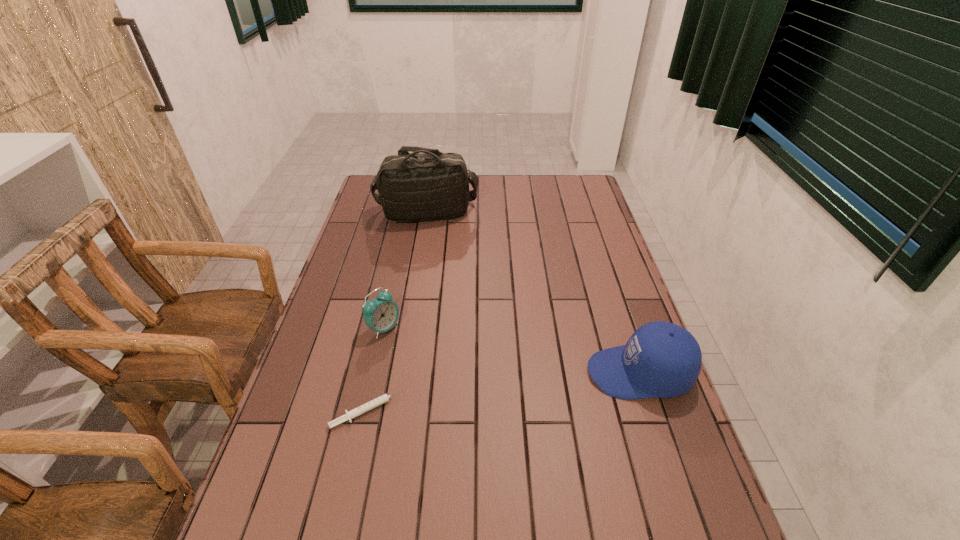
You are a GUI agent. You are given a task and a screenshot of the screen. Output one action in this format:
    pyautogui.click(x=<x>, y=<y>)
    Task: Click on the free space between the alarm clock and the tallest object
    The image size is (960, 540).
    Given the screenshot: What is the action you would take?
    pyautogui.click(x=405, y=271)

In order to click on unoccupied area between the cap and the third nearest object in this screenshot , I will do `click(512, 350)`.

Image resolution: width=960 pixels, height=540 pixels. Find the location of `free spot between the cap and the tallest object`. free spot between the cap and the tallest object is located at coordinates (533, 293).

You are a GUI agent. You are given a task and a screenshot of the screen. Output one action in this format:
    pyautogui.click(x=<x>, y=<y>)
    Task: Click on the vacant area between the rightmost object and the third nearest object
    The height and width of the screenshot is (540, 960).
    Given the screenshot: What is the action you would take?
    pyautogui.click(x=512, y=350)

Find the location of a particular element. object that is the closest to the alarm clock is located at coordinates (374, 403).

Where is `object that is the closest to the rightmost object`? This screenshot has height=540, width=960. object that is the closest to the rightmost object is located at coordinates (374, 403).

This screenshot has height=540, width=960. I want to click on free spot that satisfies the following two spatial constraints: 1. on the front side of the third nearest object; 2. on the front-facing side of the cap, so (374, 373).

Image resolution: width=960 pixels, height=540 pixels. Find the location of `free spot that satisfies the following two spatial constraints: 1. on the front side of the alarm clock; 2. on the right side of the syringe`. free spot that satisfies the following two spatial constraints: 1. on the front side of the alarm clock; 2. on the right side of the syringe is located at coordinates [366, 410].

The width and height of the screenshot is (960, 540). Identify the location of free point that satisfies the following two spatial constraints: 1. on the back side of the farthest object; 2. on the left side of the second farthest object. (410, 213).

Find the location of `free space that satisfies the following two spatial constraints: 1. on the front side of the alarm clock; 2. on the front-facing side of the rightmost object`. free space that satisfies the following two spatial constraints: 1. on the front side of the alarm clock; 2. on the front-facing side of the rightmost object is located at coordinates (374, 373).